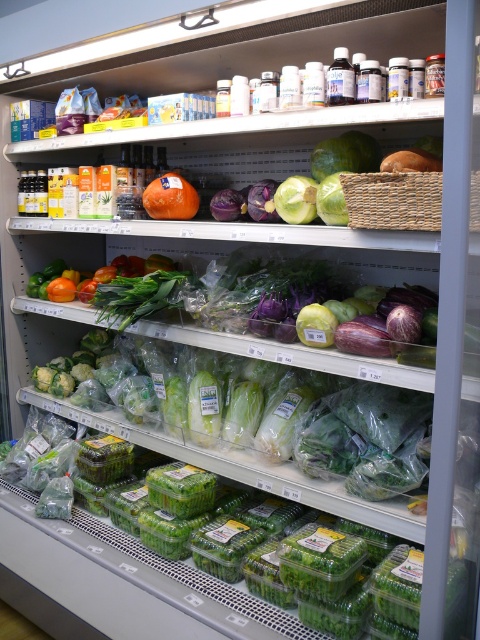
You are a grocery store employee who needs to reach the green plastic containers at center. You are standing at the viewer position. Can you safely step forward to grab them without overreaching?

The distance between the green plastic containers at center and the viewer is 1.44 meters. Since this distance is within a safe and reachable range for most people, you can step forward to grab them safely without overreaching.

You are a grocery store employee restocking the refrigerated section. You need to place a new batch of prewashed salad greens in a container that is in front of another item. Which container should you choose between the green plastic containers at center and the orange matte at center?

The green plastic containers at center is in front of the orange matte at center, so you should choose the green plastic containers at center to place the prewashed salad greens as it is positioned in front.